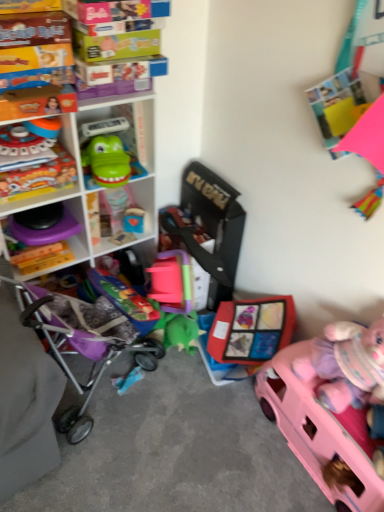
Question: Is pink plastic car at lower right, acting as the first toy starting from the right, wider or thinner than matte plastic toy at center, acting as the second toy starting from the right?

Choices:
 (A) thin
 (B) wide

Answer: (A)

Question: Looking at the image, does pink plastic car at lower right, acting as the first toy starting from the right, seem bigger or smaller compared to matte plastic toy at center, arranged as the fifth toy when viewed from the left?

Choices:
 (A) small
 (B) big

Answer: (B)

Question: Which object is positioned closest to the wooden block at center, which appears as the 3th toy when viewed from the right?

Choices:
 (A) matte plastic toy at left, which appears as the fifth toy when viewed from the right
 (B) purple plastic toy at left, which is counted as the 1th shelf, starting from the bottom
 (C) matte plastic toy at center, acting as the second toy starting from the right
 (D) white plastic shelf at upper left, positioned as the 1th shelf in top-to-bottom order
 (E) pink plastic car at lower right, acting as the first toy starting from the right

Answer: (B)

Question: Estimate the real-world distances between objects in this image. Which object is farther from the matte plastic toy at left, which appears as the fifth toy when viewed from the right?

Choices:
 (A) pink plastic car at lower right, acting as the first toy starting from the right
 (B) wooden block at center, which appears as the 3th toy when viewed from the right
 (C) white plastic shelf at upper left, positioned as the 1th shelf in top-to-bottom order
 (D) matte plastic toy at left, the 1th toy from the left
 (E) matte plastic toy at center, acting as the second toy starting from the right

Answer: (A)